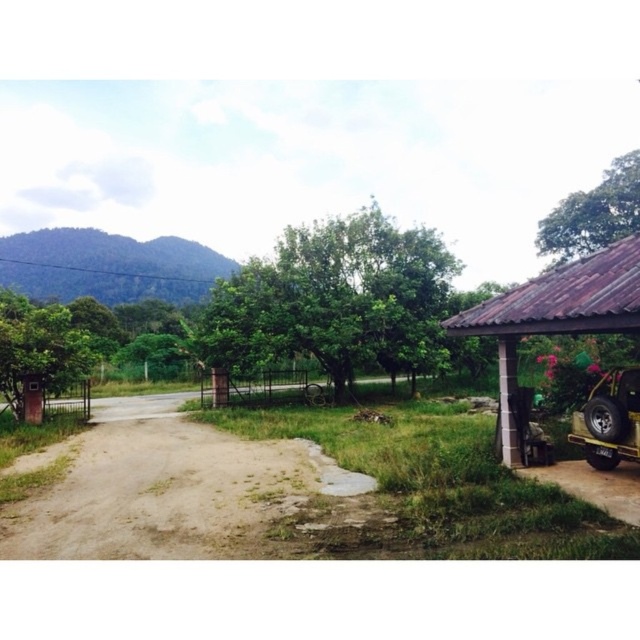
Question: Which point appears closest to the camera in this image?

Choices:
 (A) (49, 355)
 (B) (598, 445)

Answer: (B)

Question: Can you confirm if green leafy tree at left is smaller than metallic yellow jeep at lower right?

Choices:
 (A) yes
 (B) no

Answer: (B)

Question: Is green leafy tree at center smaller than brown corrugated roof at right?

Choices:
 (A) yes
 (B) no

Answer: (B)

Question: Among these objects, which one is farthest from the camera?

Choices:
 (A) brown corrugated roof at right
 (B) green leafy tree at upper right
 (C) green leafy tree at left

Answer: (B)

Question: Does green leafy tree at center have a greater width compared to green leafy tree at left?

Choices:
 (A) yes
 (B) no

Answer: (A)

Question: Which object appears farthest from the camera in this image?

Choices:
 (A) green leafy tree at center
 (B) brown corrugated roof at right
 (C) metallic yellow jeep at lower right

Answer: (A)